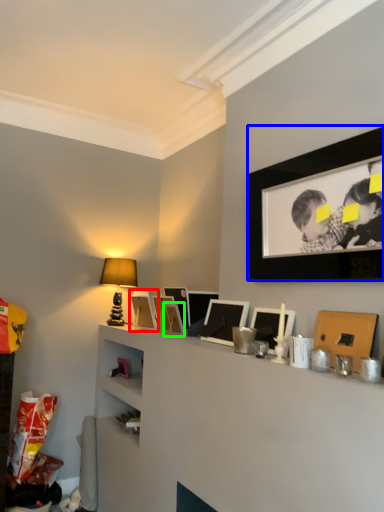
Question: Estimate the real-world distances between objects in this image. Which object is farther from picture frame (highlighted by a red box), picture frame (highlighted by a blue box) or picture frame (highlighted by a green box)?

Choices:
 (A) picture frame
 (B) picture frame

Answer: (A)